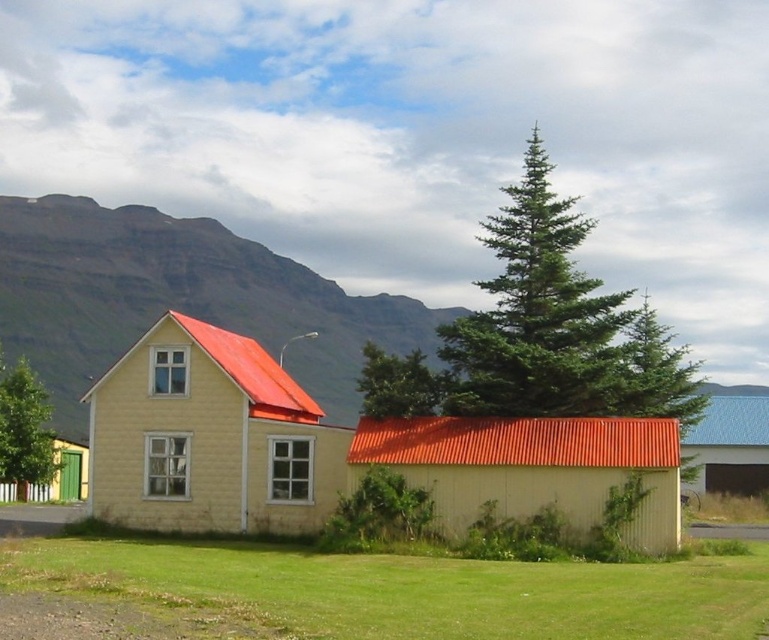
Question: Which is nearer to the green leafy tree at center?

Choices:
 (A) yellow wood house at center
 (B) green needle-like tree at center
 (C) green leafy tree at left
 (D) rugged rock mountain at left

Answer: (A)

Question: Can you confirm if yellow matte house at center is wider than green painted wooden door at lower left?

Choices:
 (A) yes
 (B) no

Answer: (B)

Question: Does rugged rock mountain at left have a lesser width compared to green leafy tree at left?

Choices:
 (A) no
 (B) yes

Answer: (A)

Question: Among these points, which one is farthest from the camera?

Choices:
 (A) (47, 461)
 (B) (192, 448)

Answer: (A)

Question: Among these objects, which one is farthest from the camera?

Choices:
 (A) metallic corrugated hut at center
 (B) green leafy tree at center
 (C) green needle-like tree at center

Answer: (B)

Question: Is yellow wood house at center positioned before green needle-like tree at center?

Choices:
 (A) yes
 (B) no

Answer: (A)